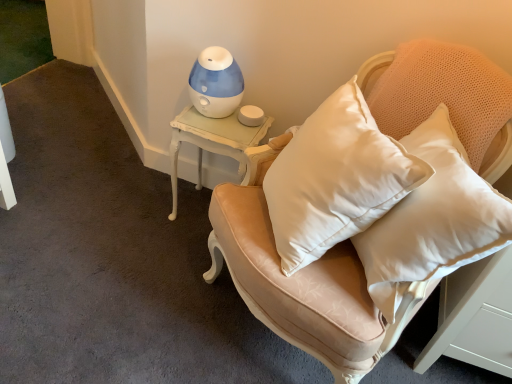
Question: Does blue plastic humidifier at upper center appear on the left side of white painted wood side table at upper left?

Choices:
 (A) no
 (B) yes

Answer: (A)

Question: Does blue plastic humidifier at upper center have a lesser height compared to white painted wood side table at upper left?

Choices:
 (A) yes
 (B) no

Answer: (A)

Question: Can you confirm if blue plastic humidifier at upper center is bigger than white painted wood side table at upper left?

Choices:
 (A) yes
 (B) no

Answer: (B)

Question: Is blue plastic humidifier at upper center wider than white painted wood side table at upper left?

Choices:
 (A) no
 (B) yes

Answer: (A)

Question: From the image's perspective, is blue plastic humidifier at upper center below white painted wood side table at upper left?

Choices:
 (A) yes
 (B) no

Answer: (B)

Question: In the image, is blue plastic humidifier at upper center positioned in front of or behind white painted wood side table at upper left?

Choices:
 (A) behind
 (B) front

Answer: (B)

Question: Visually, is blue plastic humidifier at upper center positioned to the left or to the right of white painted wood side table at upper left?

Choices:
 (A) left
 (B) right

Answer: (B)

Question: Considering the positions of blue plastic humidifier at upper center and white painted wood side table at upper left in the image, is blue plastic humidifier at upper center wider or thinner than white painted wood side table at upper left?

Choices:
 (A) thin
 (B) wide

Answer: (A)

Question: Considering the positions of blue plastic humidifier at upper center and white painted wood side table at upper left in the image, is blue plastic humidifier at upper center taller or shorter than white painted wood side table at upper left?

Choices:
 (A) short
 (B) tall

Answer: (A)

Question: From the image's perspective, is satin beige armchair at center located above or below white painted wood side table at upper left?

Choices:
 (A) below
 (B) above

Answer: (A)

Question: In terms of height, does satin beige armchair at center look taller or shorter compared to white painted wood side table at upper left?

Choices:
 (A) tall
 (B) short

Answer: (A)

Question: Based on their sizes in the image, would you say satin beige armchair at center is bigger or smaller than white painted wood side table at upper left?

Choices:
 (A) small
 (B) big

Answer: (B)

Question: Considering the positions of point (354, 324) and point (206, 117), is point (354, 324) closer or farther from the camera than point (206, 117)?

Choices:
 (A) farther
 (B) closer

Answer: (B)

Question: Considering the positions of blue plastic humidifier at upper center and satin beige armchair at center in the image, is blue plastic humidifier at upper center wider or thinner than satin beige armchair at center?

Choices:
 (A) wide
 (B) thin

Answer: (B)

Question: From the image's perspective, is blue plastic humidifier at upper center above or below satin beige armchair at center?

Choices:
 (A) below
 (B) above

Answer: (B)